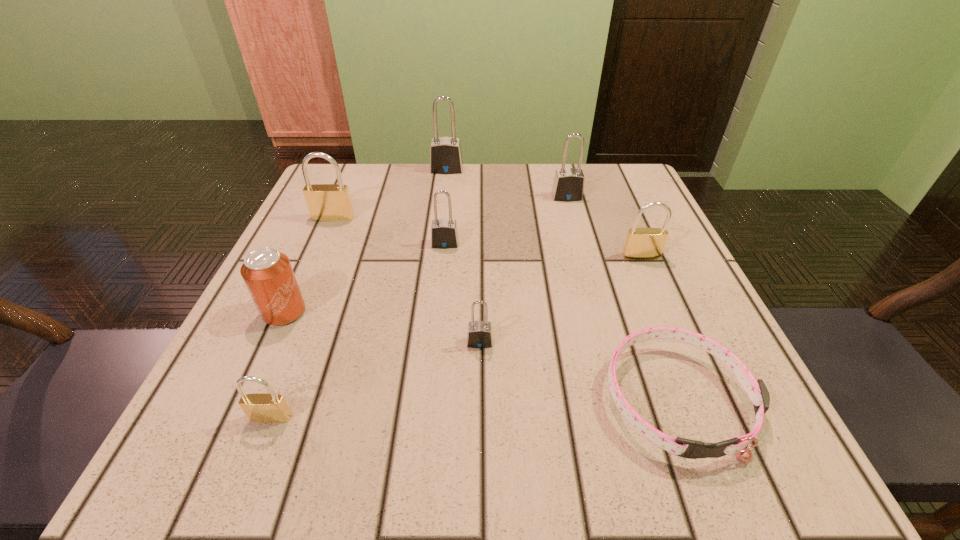
Locate an element on the screen. This screenshot has height=540, width=960. padlock that stands as the second closest to the third nearest padlock is located at coordinates (444, 234).

Where is `padlock that is the closest one to the fourth nearest padlock`? Image resolution: width=960 pixels, height=540 pixels. padlock that is the closest one to the fourth nearest padlock is located at coordinates (326, 202).

Find the location of `gray padlock that is the closest to the nearest padlock`. gray padlock that is the closest to the nearest padlock is located at coordinates (479, 334).

Choose which gray padlock is the nearest neighbor to the fourth farthest padlock. Please provide its 2D coordinates. Your answer should be formatted as a tuple, i.e. [(x, y)], where the tuple contains the x and y coordinates of a point satisfying the conditions above.

[(479, 334)]

This screenshot has height=540, width=960. I want to click on the second closest brass padlock to the farthest brass padlock, so click(641, 243).

Identify which brass padlock is the closest to the biggest gray padlock. Please provide its 2D coordinates. Your answer should be formatted as a tuple, i.e. [(x, y)], where the tuple contains the x and y coordinates of a point satisfying the conditions above.

[(326, 202)]